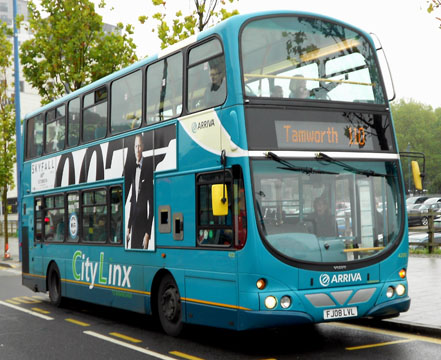
Find the location of a particular element. The height and width of the screenshot is (360, 441). mirror is located at coordinates (225, 192).